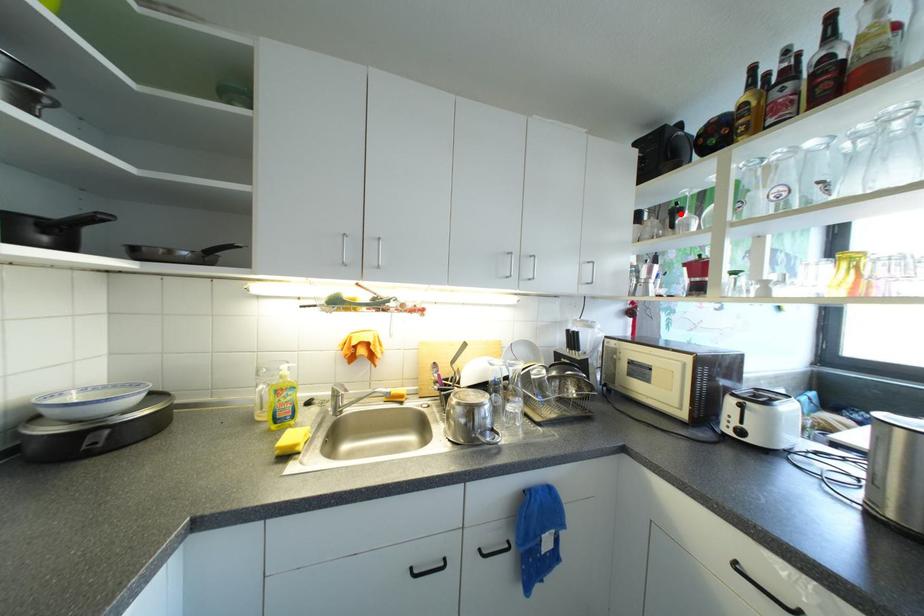
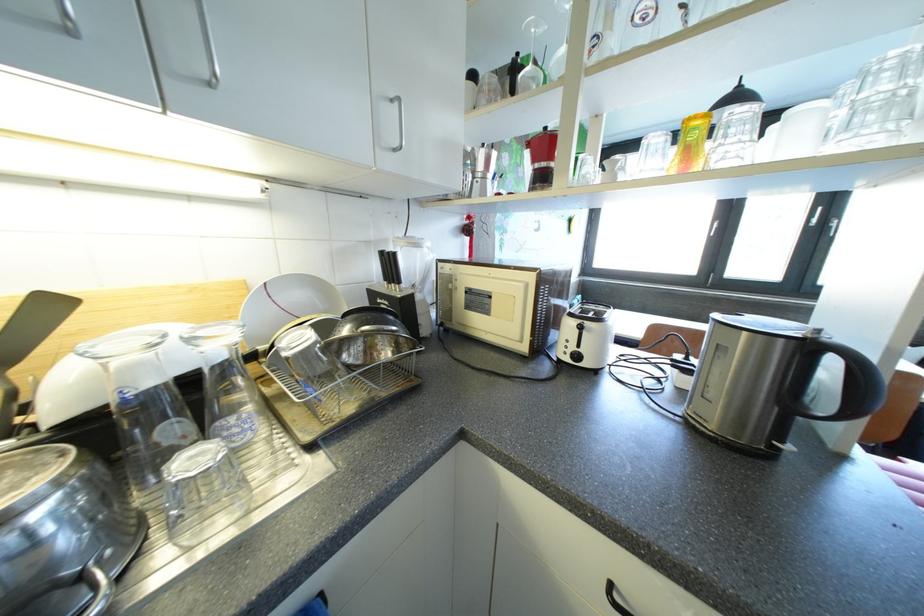
In the second image, find the point that corresponds to the highlighted location in the first image.

(520, 71)